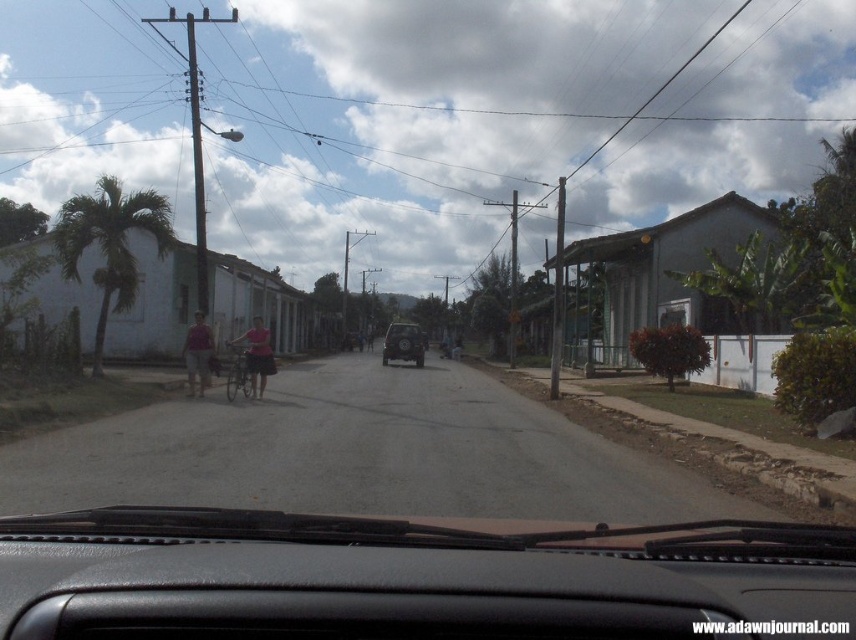
Question: Which point is closer to the camera?

Choices:
 (A) (409, 352)
 (B) (103, 268)

Answer: (B)

Question: Which point is farther to the camera?

Choices:
 (A) green leafy palm tree at left
 (B) matte pink shirt at center

Answer: (A)

Question: Can you confirm if green leafy palm tree at left is positioned to the right of shiny black suv at center?

Choices:
 (A) yes
 (B) no

Answer: (B)

Question: Observing the image, what is the correct spatial positioning of green leafy palm tree at left in reference to pink fabric shirt at center?

Choices:
 (A) left
 (B) right

Answer: (A)

Question: Estimate the real-world distances between objects in this image. Which object is closer to the shiny black suv at center?

Choices:
 (A) green leafy palm tree at left
 (B) pink fabric shirt at center

Answer: (B)

Question: Can you confirm if pink fabric shirt at center is positioned to the right of matte pink shirt at center?

Choices:
 (A) yes
 (B) no

Answer: (A)